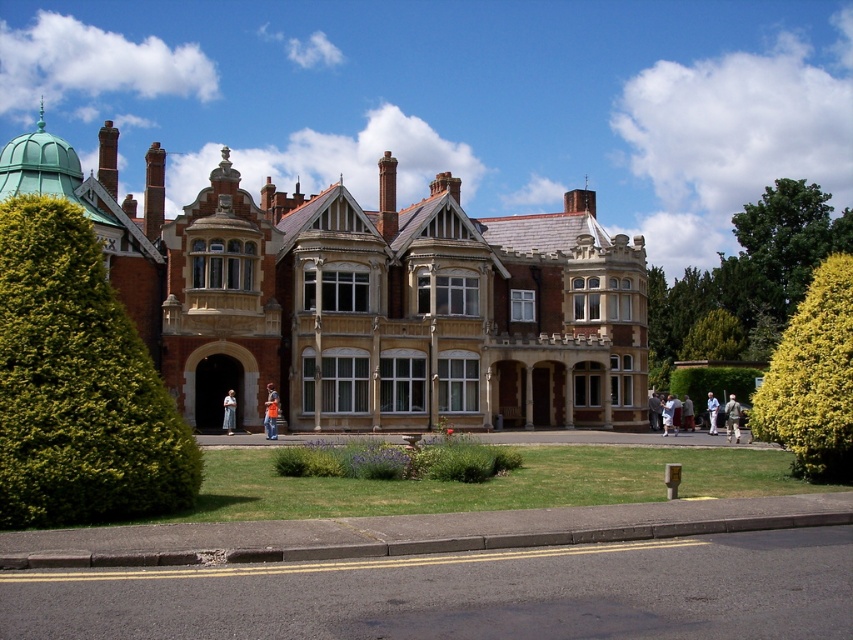
Question: Where is orange fabric shirt at center located in relation to light blue denim jeans at center in the image?

Choices:
 (A) left
 (B) right

Answer: (B)

Question: Which object appears farthest from the camera in this image?

Choices:
 (A) light blue jeans at center
 (B) light blue shirt at center
 (C) yellow-green leafy hedge at right

Answer: (A)

Question: Is brown brick mansion at center behind yellow-green leafy hedge at right?

Choices:
 (A) yes
 (B) no

Answer: (A)

Question: Which of the following is the closest to the observer?

Choices:
 (A) green leafy bush at left
 (B) light blue denim jeans at center
 (C) light blue jeans at center
 (D) orange fabric shirt at center

Answer: (A)

Question: Among these points, which one is nearest to the camera?

Choices:
 (A) (712, 349)
 (B) (732, 429)
 (C) (112, 448)

Answer: (C)

Question: Is green leafy tree at right closer to the viewer compared to yellow-green leafy hedge at right?

Choices:
 (A) yes
 (B) no

Answer: (B)